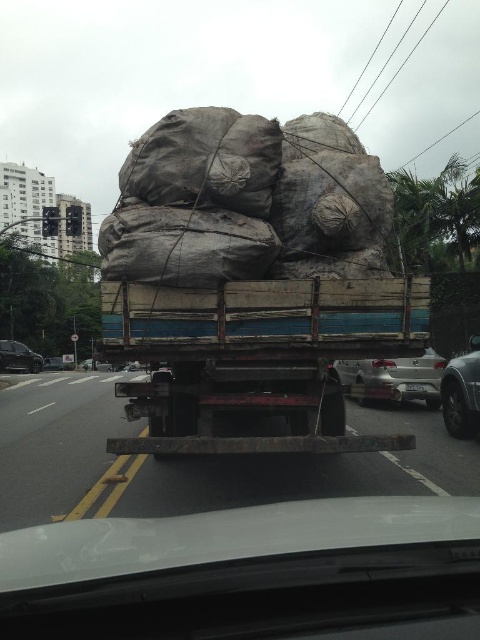
Question: Is silver metallic sedan at center positioned in front of shiny black sedan at left?

Choices:
 (A) yes
 (B) no

Answer: (A)

Question: Where is white matte car at center located in relation to shiny black sedan at left in the image?

Choices:
 (A) below
 (B) above

Answer: (B)

Question: Based on their relative distances, which object is farther from the shiny black sedan at center?

Choices:
 (A) white matte car at center
 (B) wooden trailer truck at center
 (C) silver metallic sedan at center
 (D) metallic silver car at right

Answer: (A)

Question: Estimate the real-world distances between objects in this image. Which object is closer to the metallic silver car at right?

Choices:
 (A) white matte car at center
 (B) shiny black sedan at left
 (C) silver metallic sedan at center
 (D) shiny black sedan at center

Answer: (C)

Question: Does white matte car at center come in front of metallic silver car at right?

Choices:
 (A) yes
 (B) no

Answer: (A)

Question: Considering the real-world distances, which object is closest to the shiny black sedan at center?

Choices:
 (A) wooden trailer truck at center
 (B) shiny black sedan at left

Answer: (B)